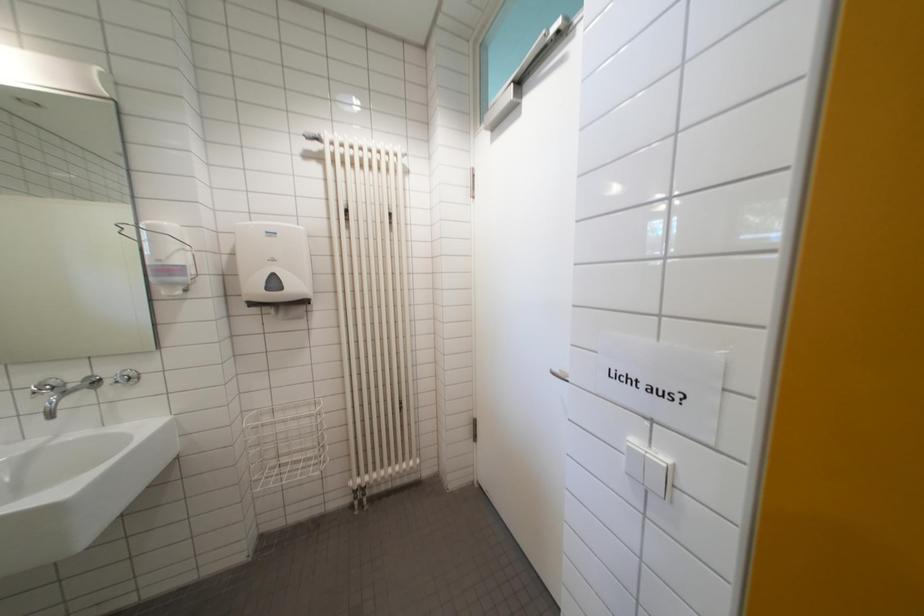
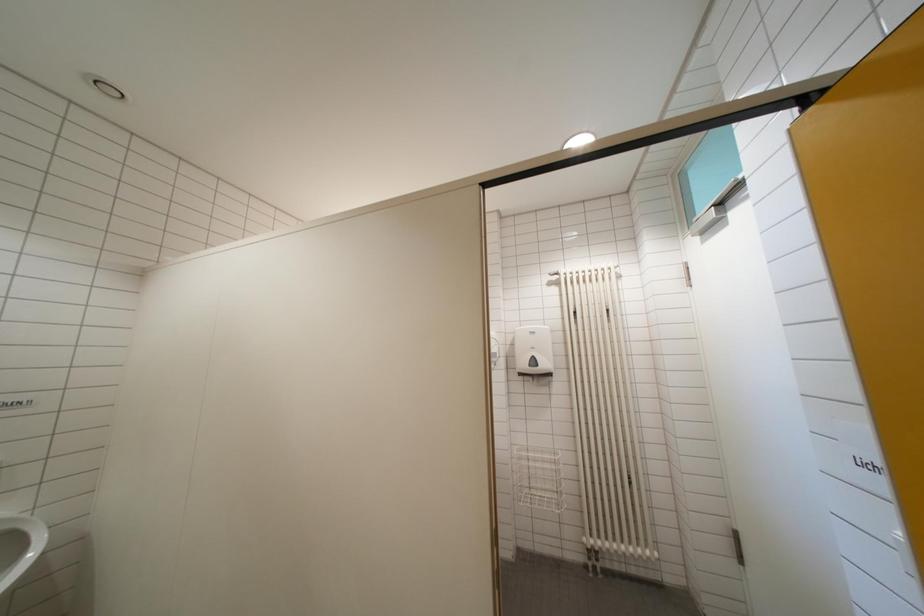
Question: The first image is from the beginning of the video and the second image is from the end. How did the camera likely rotate when shooting the video?

Choices:
 (A) Left
 (B) Right
 (C) Up
 (D) Down

Answer: (A)